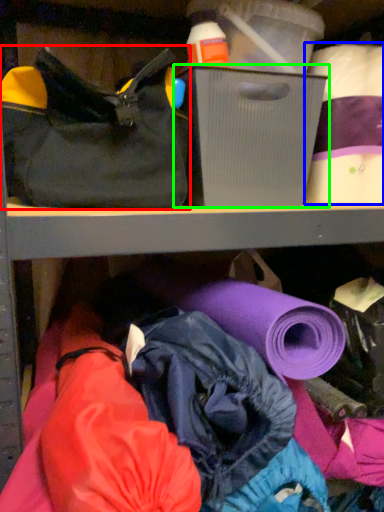
Question: Considering the real-world distances, which object is farthest from handbag (highlighted by a red box)? toilet paper (highlighted by a blue box) or storage box (highlighted by a green box)?

Choices:
 (A) toilet paper
 (B) storage box

Answer: (A)